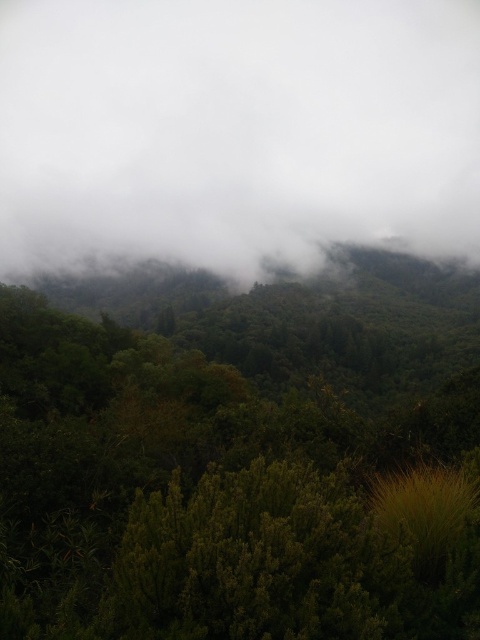
Which of these two, green leafy tree at center or white fluffy cloud at upper center, stands taller?

With more height is white fluffy cloud at upper center.

Which is in front, point (142, 628) or point (339, 128)?

Point (142, 628)

Find the location of `green leafy tree at center`. green leafy tree at center is located at coordinates (240, 454).